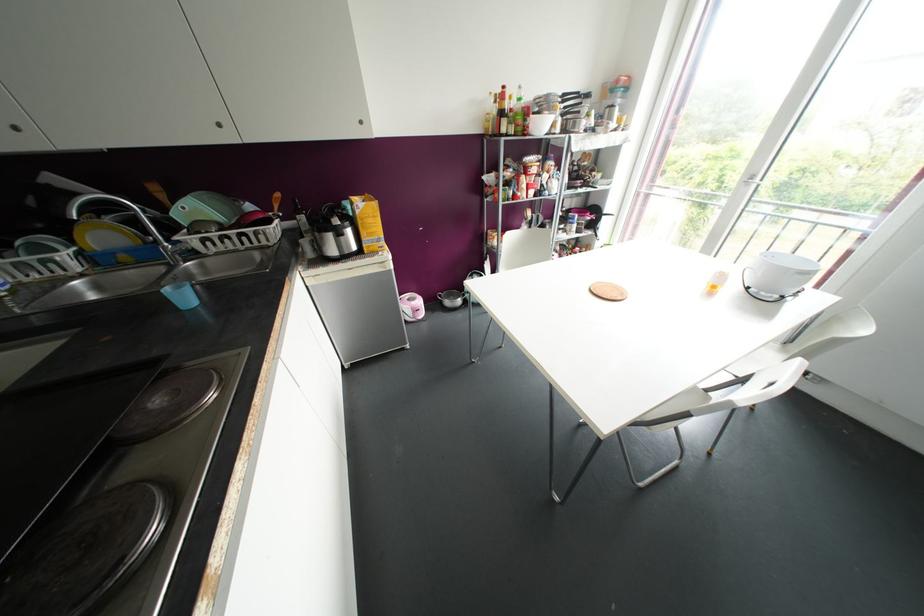
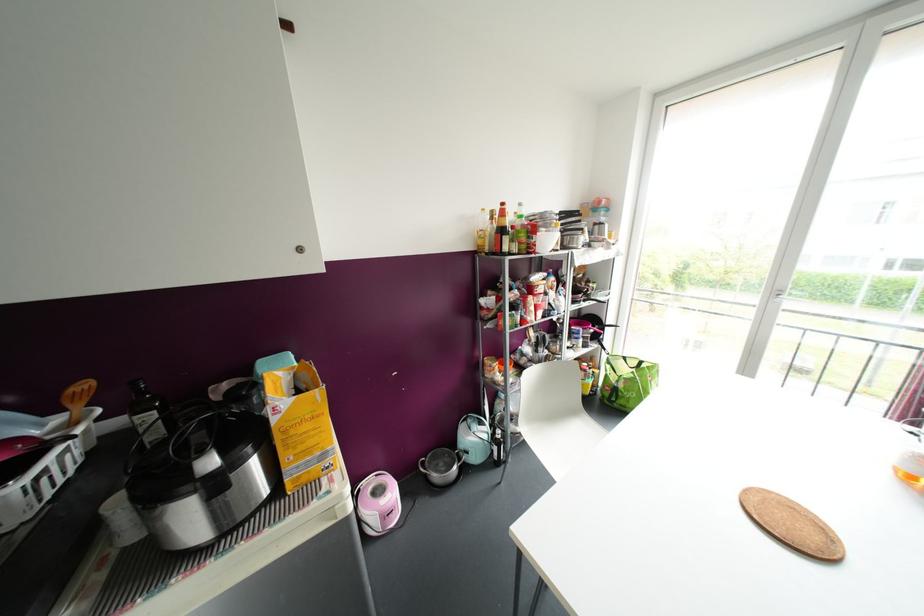
Question: I am providing you with two images of the same scene from different viewpoints. After the viewpoint changes to image2, which objects are now occluded?

Choices:
 (A) bottle with red label
 (B) brown oval tray
 (C) bottle with gold cap
 (D) none of these

Answer: (D)